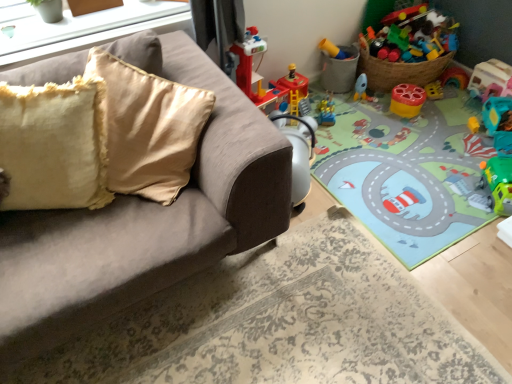
The width and height of the screenshot is (512, 384). I want to click on free space behind rubber duck at lower right, placed as the 2th toy when sorted from right to left, so pyautogui.click(x=461, y=105).